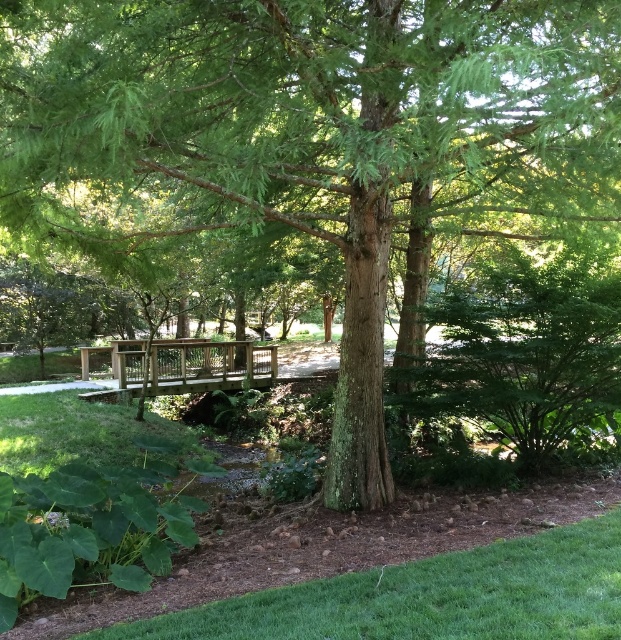
You are planning to cross the wooden bridge at center to reach the other side of the park. However, you notice the green grass at lower right. Which direction should you walk to avoid stepping on the grass?

The green grass at lower right is positioned on the right side of the wooden bridge at center. To avoid stepping on the grass, you should walk to the left side of the wooden bridge at center.

You are standing at the base of the large tree in the park scene. You notice two points marked in the image. The first point is at coordinates point (543, 532), and the second is at point (173, 348). If you want to walk towards the point that is closer to you, which coordinate should you head towards?

Point (543, 532) is in front of point (173, 348), so the closer point to you at the base of the large tree would be point (543, 532). You should head towards that coordinate.